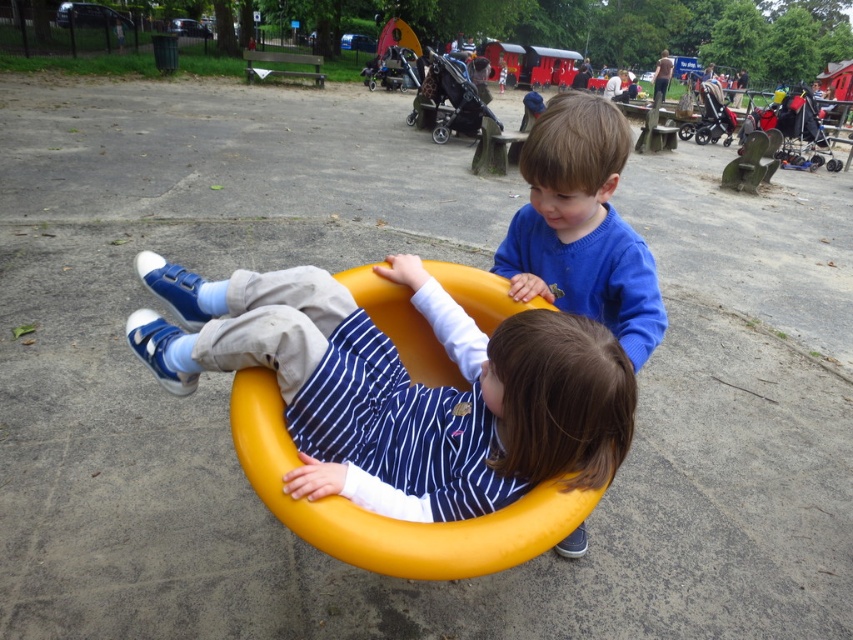
You are a parent trying to decide whether to let your child play on the matte yellow swing at center. You notice the blue knit sweater at upper center nearby. Based on their sizes, do you think the swing can accommodate the sweater if placed inside it?

The matte yellow swing at center is bigger than the blue knit sweater at upper center, so it can accommodate the sweater if placed inside it.

You are a parent trying to locate your child who is playing on the matte yellow swing at center. Based on the coordinates provided, can you determine if the swing is positioned closer to the front or the back of the image?

The matte yellow swing at center is located at coordinates point (402, 387). Since the coordinates are typically measured from the bottom left corner of an image, a y value of 0.472 places it closer to the bottom half of the image, which corresponds to the front area in this scene. Therefore, the swing is positioned closer to the front of the image.

You are standing in the park and want to place a small flag at the point closer to you between the two points, point (289, 339) and point (560, 220). Which point should you choose?

You should place the flag at point (289, 339) because it is closer to you than point (560, 220).